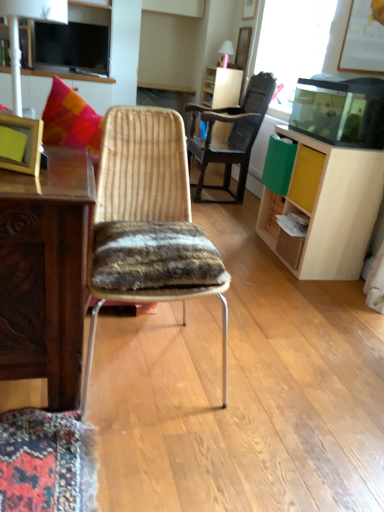
Question: Considering the positions of wooden picture frame at left and matte white lamp at upper left in the image, is wooden picture frame at left wider or thinner than matte white lamp at upper left?

Choices:
 (A) thin
 (B) wide

Answer: (A)

Question: From the image's perspective, is wooden picture frame at left located above or below matte white lamp at upper left?

Choices:
 (A) below
 (B) above

Answer: (A)

Question: Which of these objects is positioned closest to the light wood cabinet at right?

Choices:
 (A) wooden picture frame at left
 (B) matte white lamp at upper left
 (C) woven wood chair at center, positioned as the 2th chair in bottom-to-top order
 (D) light wood drawer at right
 (E) woven wood chair at center, which is counted as the first chair, starting from the bottom

Answer: (D)

Question: Based on their relative distances, which object is farther from the light wood cabinet at right?

Choices:
 (A) woven wood chair at center, acting as the 1th chair starting from the front
 (B) woven wood chair at center, placed as the 2th chair when sorted from front to back
 (C) wooden picture frame at left
 (D) matte white lamp at upper left
 (E) light wood drawer at right

Answer: (D)